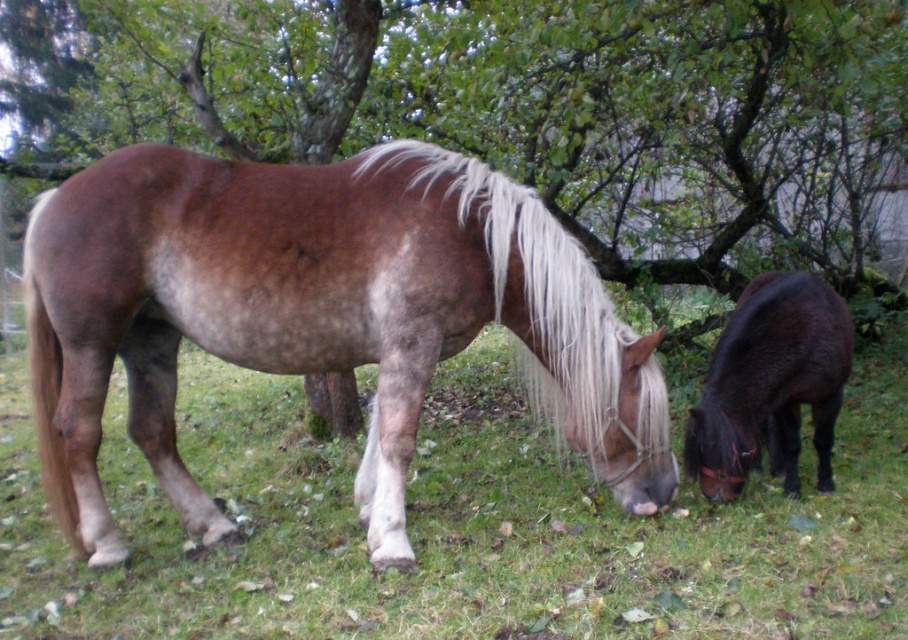
Question: Which of the following is the closest to the observer?

Choices:
 (A) green grass at center
 (B) white silky mane at center

Answer: (A)

Question: Estimate the real-world distances between objects in this image. Which object is closer to the green grass at center?

Choices:
 (A) green leafy tree at upper center
 (B) brown matte horse at center

Answer: (B)

Question: Does green leafy tree at upper center have a lesser width compared to brown matte horse at center?

Choices:
 (A) yes
 (B) no

Answer: (A)

Question: Which point is farther from the camera taking this photo?

Choices:
 (A) (844, 28)
 (B) (746, 364)
 (C) (275, 458)
 (D) (601, 342)

Answer: (C)

Question: Does green leafy tree at upper center have a greater width compared to white silky mane at center?

Choices:
 (A) no
 (B) yes

Answer: (A)

Question: Is green leafy tree at upper center closer to camera compared to shiny dark brown pony at lower right?

Choices:
 (A) no
 (B) yes

Answer: (A)